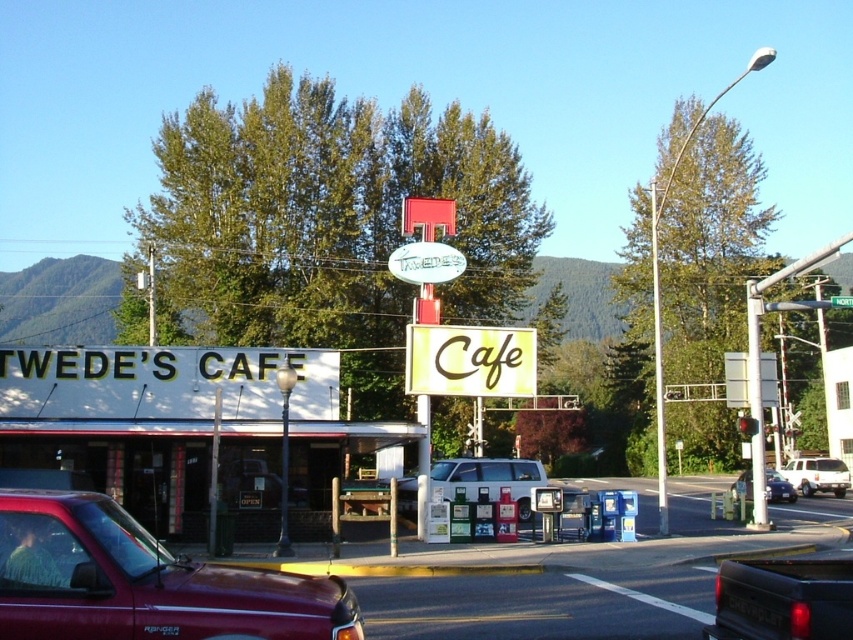
Does white matte signboard at center lie behind white matte van at center?

No.

The image size is (853, 640). Find the location of `white matte signboard at center`. white matte signboard at center is located at coordinates (181, 422).

You are a GUI agent. You are given a task and a screenshot of the screen. Output one action in this format:
    pyautogui.click(x=<x>, y=<y>)
    Task: Click on the matte black truck at lower right
    
    Given the screenshot: What is the action you would take?
    pyautogui.click(x=782, y=600)

Can you confirm if matte black truck at lower right is shorter than yellow matte cafe at center?

Indeed, matte black truck at lower right has a lesser height compared to yellow matte cafe at center.

Which is behind, point (746, 625) or point (454, 348)?

Point (454, 348)

This screenshot has height=640, width=853. In order to click on matte black truck at lower right in this screenshot , I will do `click(782, 600)`.

Can you confirm if metallic red truck at lower left is taller than white matte van at center?

In fact, metallic red truck at lower left may be shorter than white matte van at center.

Between metallic red truck at lower left and white matte van at center, which one is positioned higher?

metallic red truck at lower left is above.

Find the location of a particular element. metallic red truck at lower left is located at coordinates pos(143,580).

At what (x,y) coordinates should I click in order to perform the action: click on metallic red truck at lower left. Please return your answer as a coordinate pair (x, y). The width and height of the screenshot is (853, 640). Looking at the image, I should click on (143, 580).